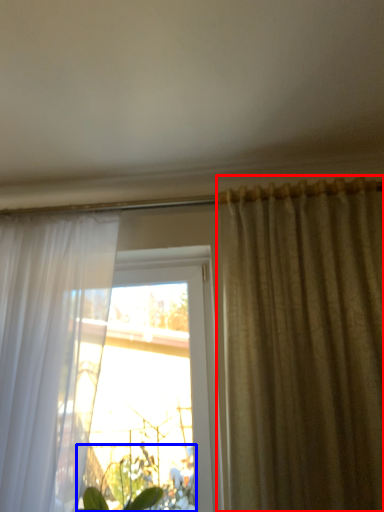
Question: Which point is closer to the camera, curtain (highlighted by a red box) or vegetation (highlighted by a blue box)?

Choices:
 (A) curtain
 (B) vegetation

Answer: (A)